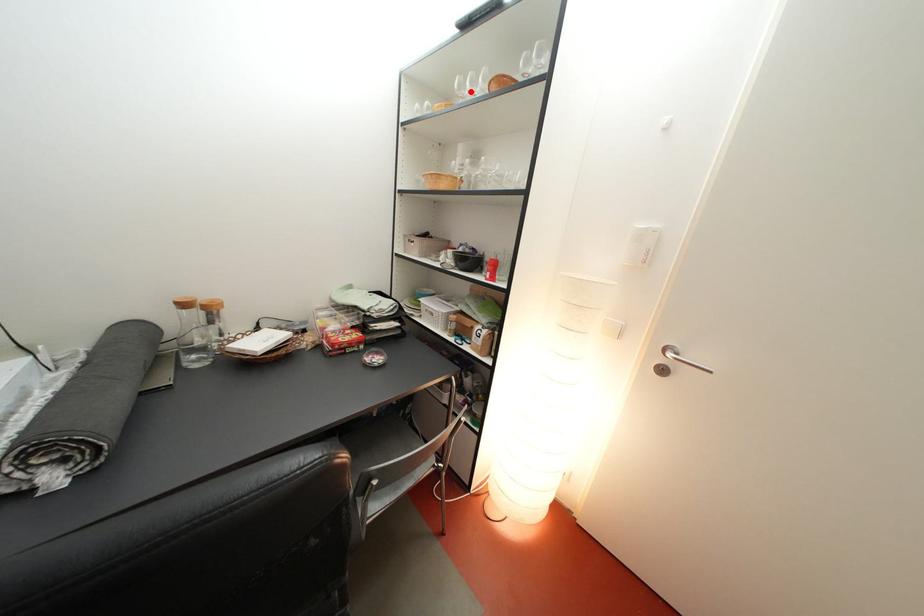
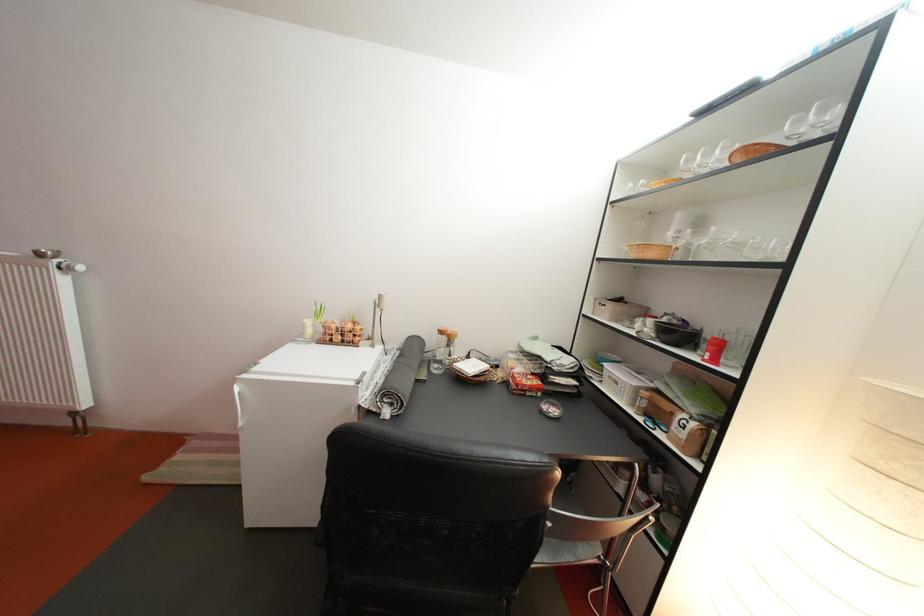
In the second image, find the point that corresponds to the highlighted location in the first image.

(698, 168)